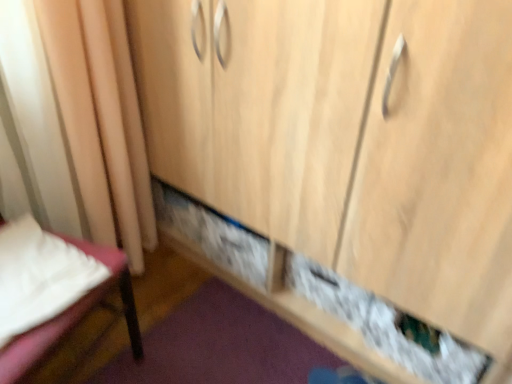
Question: Is beige fabric curtain at left taller or shorter than white fabric bed at lower left?

Choices:
 (A) tall
 (B) short

Answer: (A)

Question: From a real-world perspective, is beige fabric curtain at left above or below white fabric bed at lower left?

Choices:
 (A) below
 (B) above

Answer: (B)

Question: Is beige fabric curtain at left bigger or smaller than white fabric bed at lower left?

Choices:
 (A) small
 (B) big

Answer: (B)

Question: Is white fabric bed at lower left bigger or smaller than beige fabric curtain at left?

Choices:
 (A) big
 (B) small

Answer: (B)

Question: Relative to beige fabric curtain at left, is white fabric bed at lower left in front or behind?

Choices:
 (A) behind
 (B) front

Answer: (B)

Question: Is white fabric bed at lower left situated inside beige fabric curtain at left or outside?

Choices:
 (A) inside
 (B) outside

Answer: (B)

Question: Is white fabric bed at lower left to the left or to the right of beige fabric curtain at left in the image?

Choices:
 (A) left
 (B) right

Answer: (A)